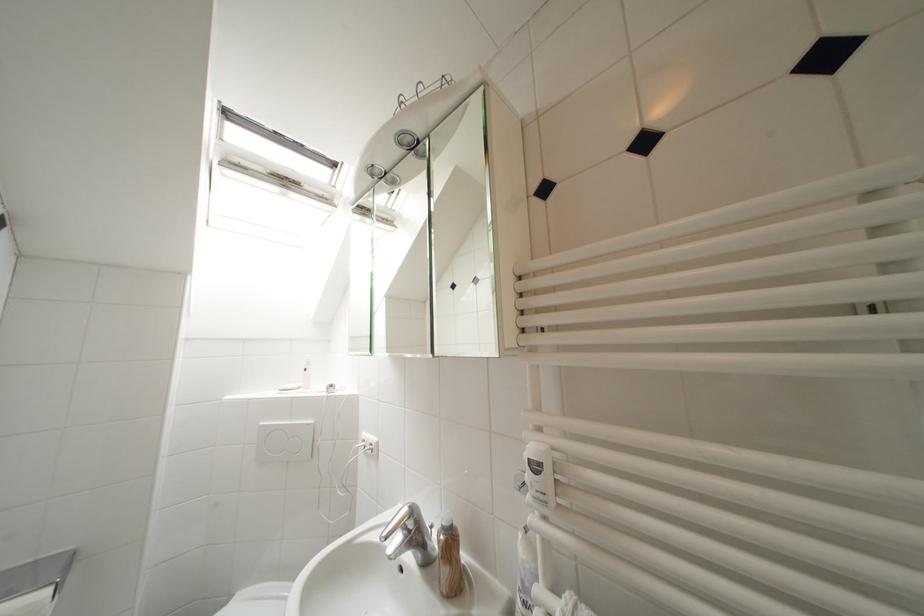
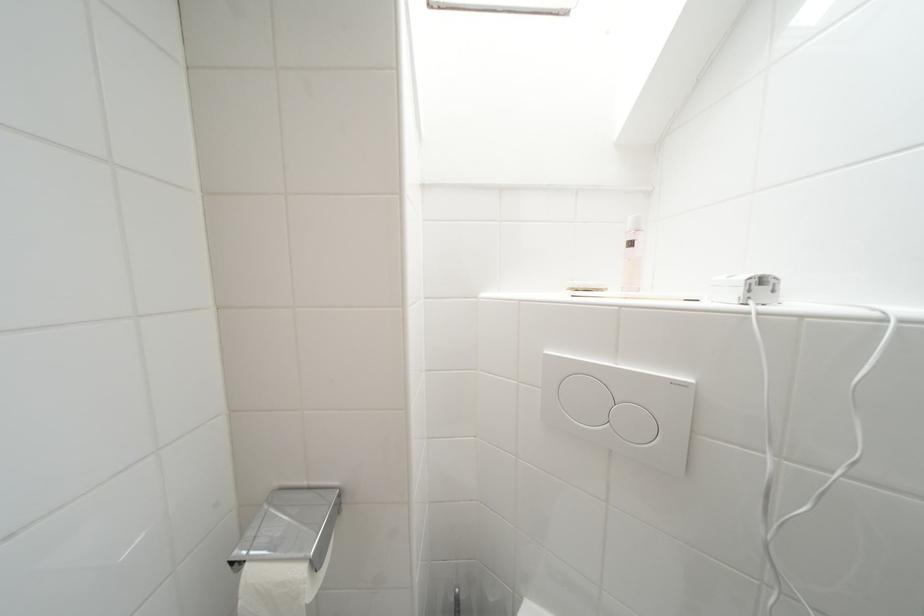
The point at (338, 389) is marked in the first image. Where is the corresponding point in the second image?

(769, 283)